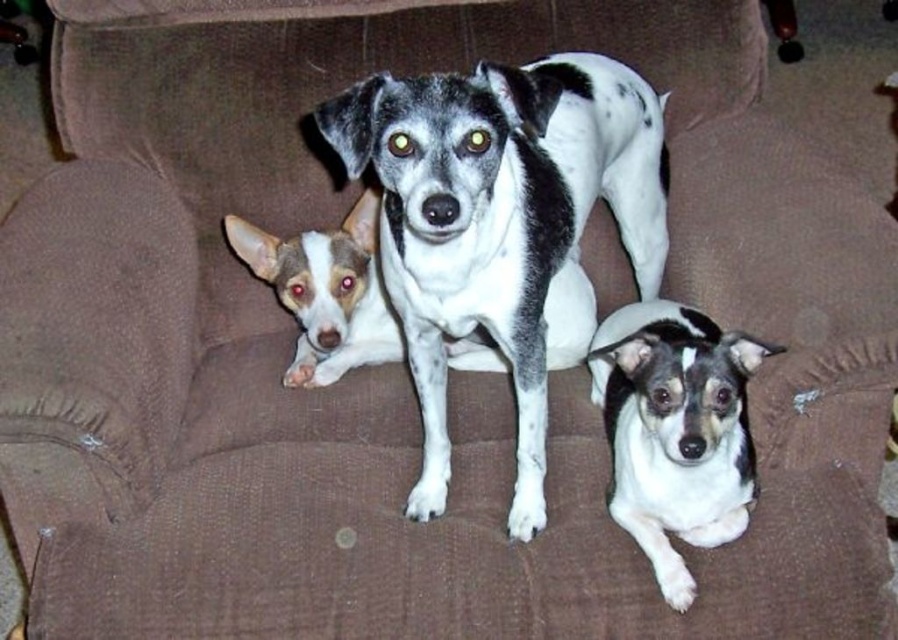
Question: Among these objects, which one is farthest from the camera?

Choices:
 (A) white-spotted fur dog at center
 (B) white and black fur dog at center
 (C) white and gray fur dog at center

Answer: (C)

Question: Which point appears farthest from the camera in this image?

Choices:
 (A) (705, 321)
 (B) (389, 305)
 (C) (445, 253)

Answer: (B)

Question: Can you confirm if white-spotted fur dog at center is positioned below white and gray fur dog at center?

Choices:
 (A) yes
 (B) no

Answer: (B)

Question: Is white-spotted fur dog at center positioned at the back of white and black fur dog at center?

Choices:
 (A) yes
 (B) no

Answer: (B)

Question: Which of the following is the closest to the observer?

Choices:
 (A) pyautogui.click(x=399, y=112)
 (B) pyautogui.click(x=309, y=385)

Answer: (A)

Question: Is white-spotted fur dog at center thinner than white and gray fur dog at center?

Choices:
 (A) no
 (B) yes

Answer: (B)